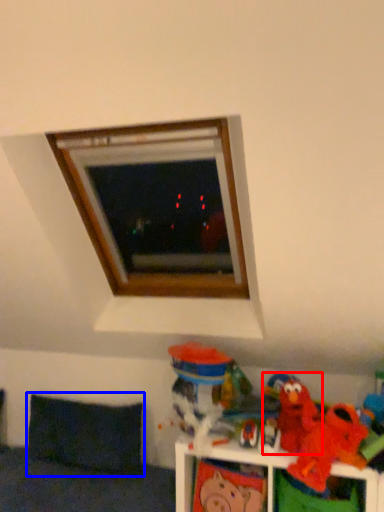
Question: Which object appears farthest to the camera in this image, toy (highlighted by a red box) or pillow (highlighted by a blue box)?

Choices:
 (A) toy
 (B) pillow

Answer: (B)